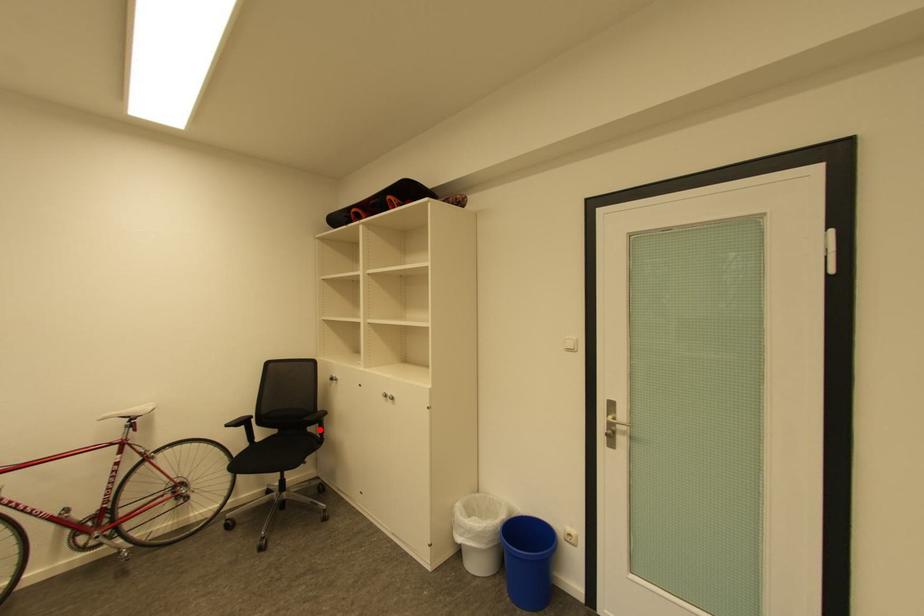
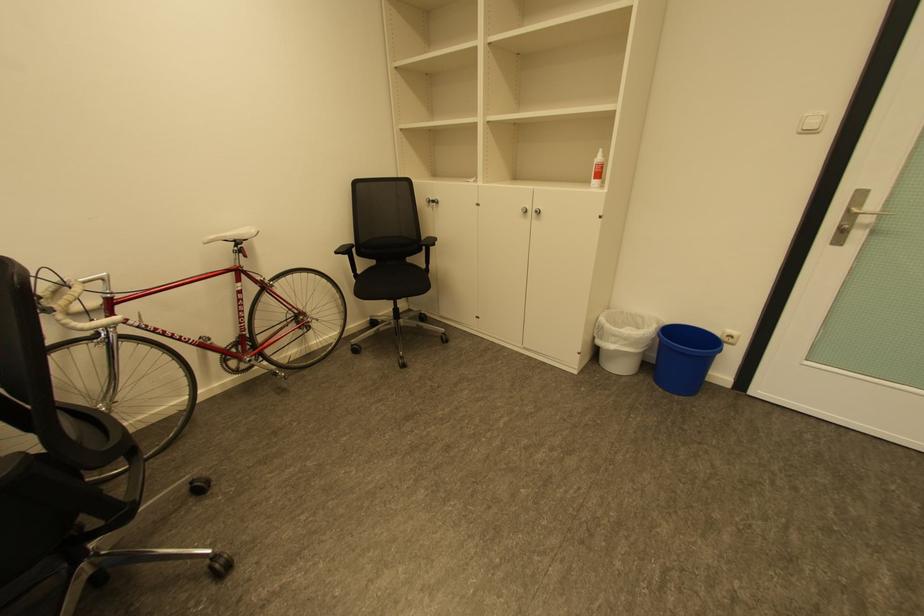
The point at the highlighted location is marked in the first image. Where is the corresponding point in the second image?

(426, 259)